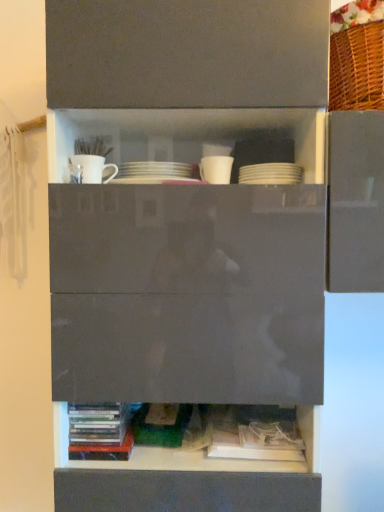
Question: Considering the positions of white matte mug at upper left, marked as the 1th tableware in a left-to-right arrangement, and multicolored plastic books at lower left, placed as the 2th book when sorted from right to left, in the image, is white matte mug at upper left, marked as the 1th tableware in a left-to-right arrangement, wider or thinner than multicolored plastic books at lower left, placed as the 2th book when sorted from right to left,?

Choices:
 (A) thin
 (B) wide

Answer: (A)

Question: From the image's perspective, is white matte mug at upper left, marked as the 1th tableware in a left-to-right arrangement, located above or below multicolored plastic books at lower left, the first book from the left?

Choices:
 (A) below
 (B) above

Answer: (B)

Question: Which object is the farthest from the white paper book at lower center, the first book viewed from the right?

Choices:
 (A) white matte mug at upper center, positioned as the 2th tableware in left-to-right order
 (B) white matte plates at upper center, which appears as the 1th tableware when viewed from the right
 (C) multicolored plastic books at lower left, the first book from the left
 (D) white matte mug at upper left, which appears as the third tableware when viewed from the right

Answer: (D)

Question: Based on their relative distances, which object is farther from the white paper book at lower center, the first book viewed from the right?

Choices:
 (A) white matte mug at upper center, positioned as the 2th tableware in left-to-right order
 (B) multicolored plastic books at lower left, placed as the 2th book when sorted from right to left
 (C) white matte mug at upper left, marked as the 1th tableware in a left-to-right arrangement
 (D) white matte plates at upper center, which appears as the 1th tableware when viewed from the right

Answer: (C)